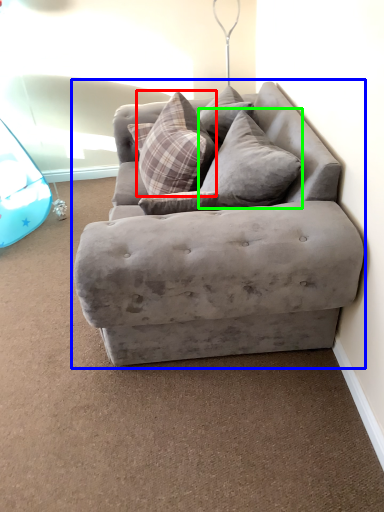
Question: Which object is positioned farthest from pillow (highlighted by a red box)? Select from studio couch (highlighted by a blue box) and pillow (highlighted by a green box).

Choices:
 (A) studio couch
 (B) pillow

Answer: (A)